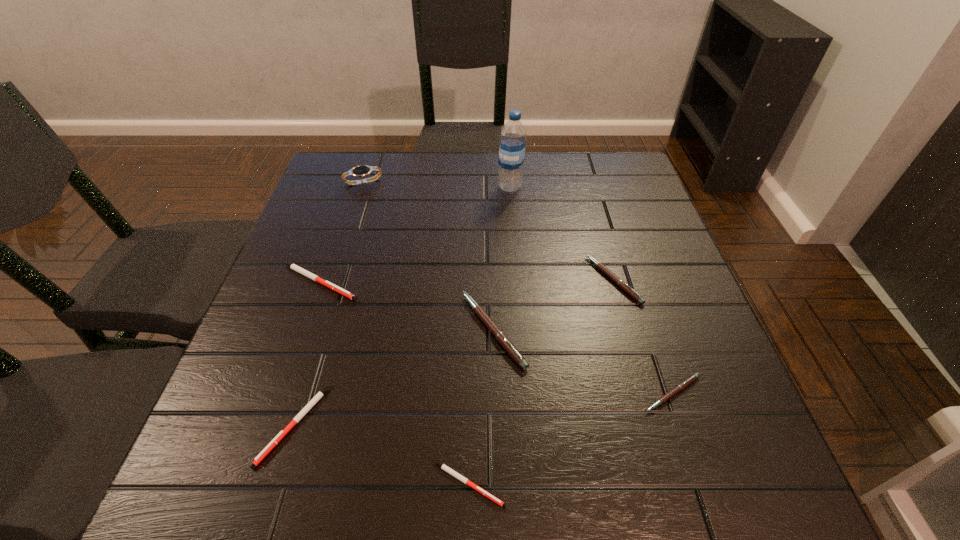
At what (x,y) coordinates should I click in order to perform the action: click on vacant space at the far edge of the desktop. Please return your answer as a coordinate pair (x, y). Image resolution: width=960 pixels, height=540 pixels. Looking at the image, I should click on (474, 171).

The image size is (960, 540). What are the coordinates of `blank space at the near edge` in the screenshot? It's located at 608,486.

What are the coordinates of `vacant space at the left edge of the desktop` in the screenshot? It's located at point(344,267).

You are a GUI agent. You are given a task and a screenshot of the screen. Output one action in this format:
    pyautogui.click(x=<x>, y=<y>)
    Task: Click on the free region at the right edge of the desktop
    
    Given the screenshot: What is the action you would take?
    pyautogui.click(x=629, y=251)

This screenshot has width=960, height=540. What are the coordinates of `vacant area between the smallest white pen and the second biggest white pen` in the screenshot? It's located at (381, 454).

At what (x,y) coordinates should I click in order to perform the action: click on vacant space in between the second smallest white pen and the leftmost pink pen. Please return your answer as a coordinate pair (x, y). Looking at the image, I should click on point(394,377).

Find the location of `vacant area that lies between the second smallest pink pen and the leftmost pink pen`. vacant area that lies between the second smallest pink pen and the leftmost pink pen is located at coordinates (554, 305).

What are the coordinates of `free space between the second smallest white pen and the second biggest pink pen` in the screenshot? It's located at (454, 352).

At what (x,y) coordinates should I click in order to perform the action: click on free area in between the second biggest white pen and the smallest pink pen. Please return your answer as a coordinate pair (x, y). Image resolution: width=960 pixels, height=540 pixels. Looking at the image, I should click on (483, 409).

Where is `vacant point located between the watch and the tallest pen`? Image resolution: width=960 pixels, height=540 pixels. vacant point located between the watch and the tallest pen is located at coordinates (428, 256).